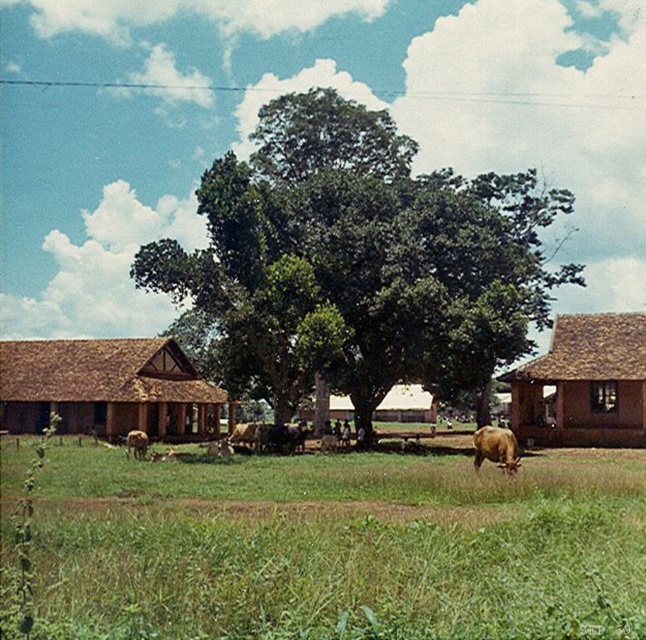
Does point (503, 429) come behind point (211, 456)?

No, it is not.

Based on the photo, between brown matte cow at lower right and brown furry cow at center, which one has more height?

With more height is brown matte cow at lower right.

Between point (516, 468) and point (207, 454), which one is positioned in front?

Point (516, 468) is more forward.

Locate an element on the screen. This screenshot has width=646, height=640. brown matte cow at lower right is located at coordinates (495, 448).

Can you confirm if green leafy tree at center is positioned below brown thatched roof hut at left?

Actually, green leafy tree at center is above brown thatched roof hut at left.

Between green leafy tree at center and brown thatched roof hut at left, which one is positioned lower?

brown thatched roof hut at left is lower down.

Where is `green leafy tree at center`? green leafy tree at center is located at coordinates (359, 259).

Looking at this image, does brown thatched roof hut at left have a lesser width compared to brown furry cow at center?

In fact, brown thatched roof hut at left might be wider than brown furry cow at center.

Between brown thatched roof hut at left and brown furry cow at center, which one has less height?

With less height is brown furry cow at center.

This screenshot has height=640, width=646. I want to click on brown thatched roof hut at left, so click(107, 388).